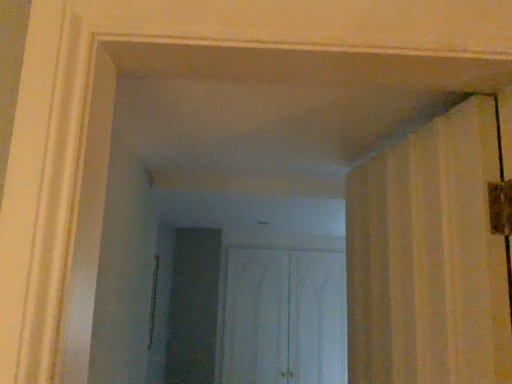
Find the location of a particular element. Image resolution: width=512 pixels, height=384 pixels. white wood barn door at center is located at coordinates (x=285, y=318).

The width and height of the screenshot is (512, 384). Describe the element at coordinates (285, 318) in the screenshot. I see `white wood barn door at center` at that location.

Locate an element on the screen. white wood barn door at center is located at coordinates (285, 318).